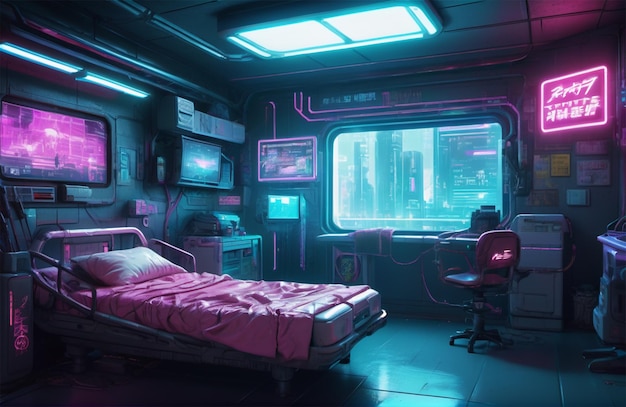
Image resolution: width=626 pixels, height=407 pixels. I want to click on bed frame, so click(x=57, y=240).